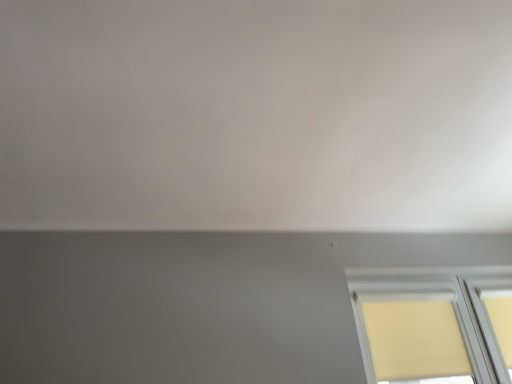
Question: Is beige fabric window at lower right spatially inside white matte wall at upper center, or outside of it?

Choices:
 (A) outside
 (B) inside

Answer: (A)

Question: From the image's perspective, is beige fabric window at lower right located above or below white matte wall at upper center?

Choices:
 (A) below
 (B) above

Answer: (A)

Question: Would you say beige fabric window at lower right is to the left or to the right of white matte wall at upper center in the picture?

Choices:
 (A) right
 (B) left

Answer: (A)

Question: Does point (40, 46) appear closer or farther from the camera than point (376, 319)?

Choices:
 (A) closer
 (B) farther

Answer: (A)

Question: Considering their positions, is white matte wall at upper center located in front of or behind beige fabric window at lower right?

Choices:
 (A) front
 (B) behind

Answer: (A)

Question: Is white matte wall at upper center spatially inside beige fabric window at lower right, or outside of it?

Choices:
 (A) inside
 (B) outside

Answer: (B)

Question: Visually, is white matte wall at upper center positioned to the left or to the right of beige fabric window at lower right?

Choices:
 (A) right
 (B) left

Answer: (B)